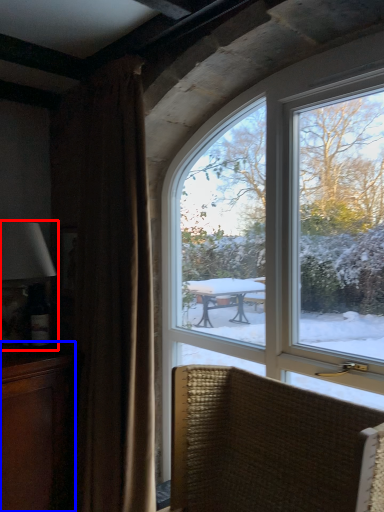
Question: Among these objects, which one is farthest to the camera, table lamp (highlighted by a red box) or cabinetry (highlighted by a blue box)?

Choices:
 (A) table lamp
 (B) cabinetry

Answer: (A)